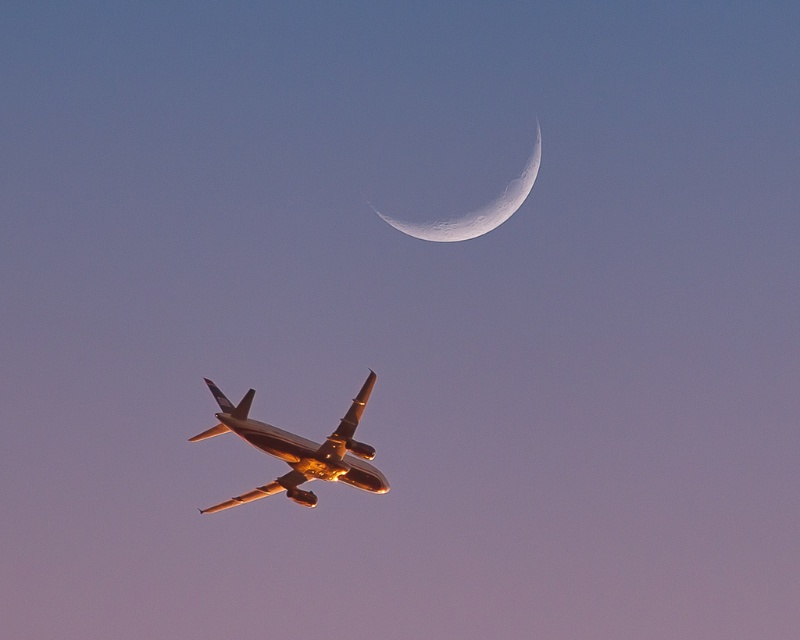
Which is behind, point (289, 436) or point (498, 200)?

Point (498, 200)

The height and width of the screenshot is (640, 800). I want to click on metallic gold airplane at center, so click(x=300, y=449).

Which is in front, point (356, 484) or point (509, 182)?

Point (356, 484) is in front.

Where is `metallic gold airplane at center`? The height and width of the screenshot is (640, 800). metallic gold airplane at center is located at coordinates (300, 449).